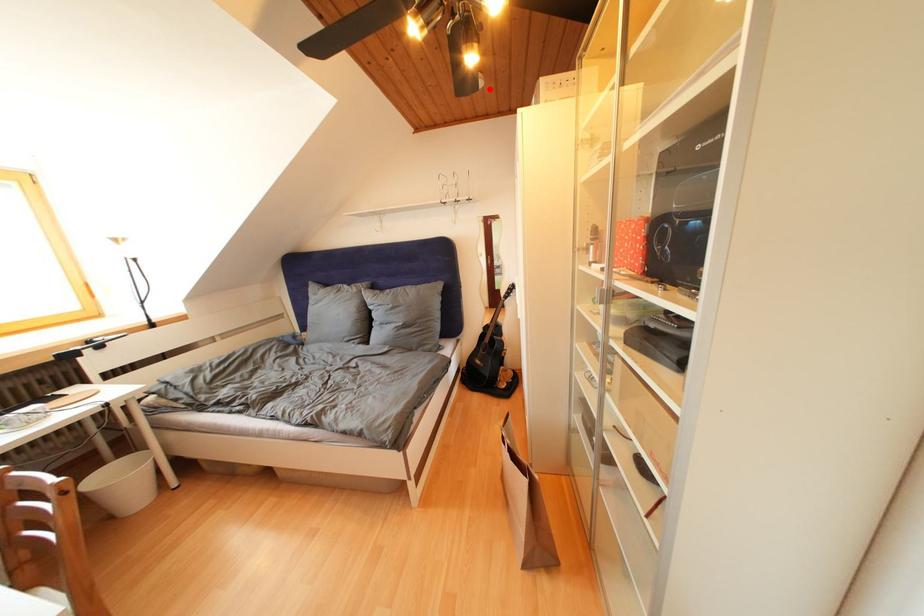
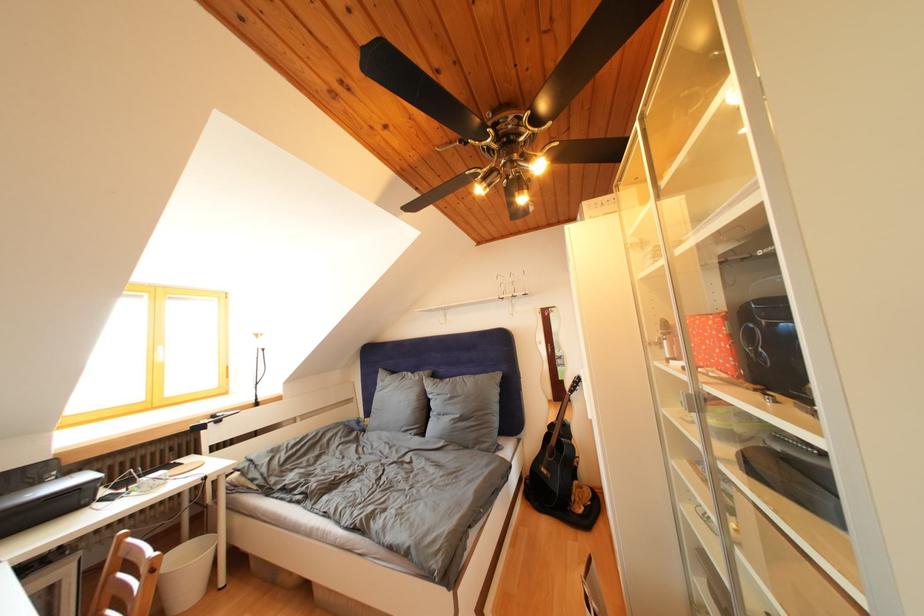
Where in the second image is the point corresponding to the highlighted location from the first image?

(540, 214)